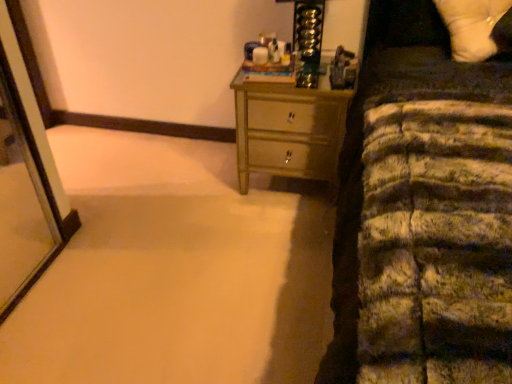
Image resolution: width=512 pixels, height=384 pixels. What do you see at coordinates (287, 128) in the screenshot?
I see `metallic gold chest of drawers at center` at bounding box center [287, 128].

This screenshot has width=512, height=384. What are the coordinates of `metallic gold chest of drawers at center` in the screenshot? It's located at (287, 128).

This screenshot has width=512, height=384. Identify the location of white soft pillow at upper right. (472, 26).

Measure the distance between white soft pillow at upper right and camera.

A distance of 4.73 feet exists between white soft pillow at upper right and camera.

Describe the element at coordinates (472, 26) in the screenshot. This screenshot has width=512, height=384. I see `white soft pillow at upper right` at that location.

Locate an element on the screen. The width and height of the screenshot is (512, 384). metallic gold chest of drawers at center is located at coordinates (287, 128).

Which is more to the right, metallic gold chest of drawers at center or white soft pillow at upper right?

Positioned to the right is white soft pillow at upper right.

In the image, is metallic gold chest of drawers at center positioned in front of or behind white soft pillow at upper right?

Visually, metallic gold chest of drawers at center is located behind white soft pillow at upper right.

Considering the positions of points (245, 130) and (488, 47), is point (245, 130) closer to camera compared to point (488, 47)?

No, it is not.

From the image's perspective, is metallic gold chest of drawers at center positioned above or below white soft pillow at upper right?

From the image's perspective, metallic gold chest of drawers at center appears below white soft pillow at upper right.

From a real-world perspective, is metallic gold chest of drawers at center physically below white soft pillow at upper right?

Yes, from a real-world perspective, metallic gold chest of drawers at center is beneath white soft pillow at upper right.

Considering the relative sizes of metallic gold chest of drawers at center and white soft pillow at upper right in the image provided, is metallic gold chest of drawers at center thinner than white soft pillow at upper right?

Incorrect, the width of metallic gold chest of drawers at center is not less than that of white soft pillow at upper right.

Considering the relative sizes of metallic gold chest of drawers at center and white soft pillow at upper right in the image provided, is metallic gold chest of drawers at center taller than white soft pillow at upper right?

Correct, metallic gold chest of drawers at center is much taller as white soft pillow at upper right.

Can you confirm if metallic gold chest of drawers at center is smaller than white soft pillow at upper right?

Actually, metallic gold chest of drawers at center might be larger than white soft pillow at upper right.

Is white soft pillow at upper right located within metallic gold chest of drawers at center?

Actually, white soft pillow at upper right is outside metallic gold chest of drawers at center.

Are metallic gold chest of drawers at center and white soft pillow at upper right far apart?

No, metallic gold chest of drawers at center is not far from white soft pillow at upper right.

Is metallic gold chest of drawers at center facing away from white soft pillow at upper right?

No.

There is a metallic gold chest of drawers at center. Where is `pillow above it (from a real-world perspective)`? Image resolution: width=512 pixels, height=384 pixels. pillow above it (from a real-world perspective) is located at coordinates click(472, 26).

Which is more to the right, white soft pillow at upper right or metallic gold chest of drawers at center?

white soft pillow at upper right is more to the right.

Considering the relative positions of white soft pillow at upper right and metallic gold chest of drawers at center in the image provided, is white soft pillow at upper right behind metallic gold chest of drawers at center?

No, it is in front of metallic gold chest of drawers at center.

Does point (507, 9) come in front of point (294, 79)?

Yes, point (507, 9) is in front of point (294, 79).

From the image's perspective, would you say white soft pillow at upper right is shown under metallic gold chest of drawers at center?

No.

Consider the image. From a real-world perspective, is white soft pillow at upper right on metallic gold chest of drawers at center?

Yes.

Looking at their sizes, would you say white soft pillow at upper right is wider or thinner than metallic gold chest of drawers at center?

In the image, white soft pillow at upper right appears to be more narrow than metallic gold chest of drawers at center.

In terms of height, does white soft pillow at upper right look taller or shorter compared to metallic gold chest of drawers at center?

white soft pillow at upper right is shorter than metallic gold chest of drawers at center.

Does white soft pillow at upper right have a larger size compared to metallic gold chest of drawers at center?

No, white soft pillow at upper right is not bigger than metallic gold chest of drawers at center.

Choose the correct answer: Is white soft pillow at upper right inside metallic gold chest of drawers at center or outside it?

white soft pillow at upper right lies outside metallic gold chest of drawers at center.

Is white soft pillow at upper right touching metallic gold chest of drawers at center?

white soft pillow at upper right and metallic gold chest of drawers at center are clearly separated.

Is white soft pillow at upper right turned away from metallic gold chest of drawers at center?

No, white soft pillow at upper right's orientation is not away from metallic gold chest of drawers at center.

Based on the photo, how many degrees apart are the facing directions of white soft pillow at upper right and metallic gold chest of drawers at center?

The facing directions of white soft pillow at upper right and metallic gold chest of drawers at center are 7.64 degrees apart.

How distant is white soft pillow at upper right from metallic gold chest of drawers at center?

white soft pillow at upper right and metallic gold chest of drawers at center are 25.59 inches apart.

The height and width of the screenshot is (384, 512). What are the coordinates of `the chest of drawers located underneath the white soft pillow at upper right (from a real-world perspective)` in the screenshot? It's located at (287, 128).

The image size is (512, 384). I want to click on pillow above the metallic gold chest of drawers at center (from the image's perspective), so click(472, 26).

This screenshot has height=384, width=512. Identify the location of the chest of drawers that is behind the white soft pillow at upper right. (287, 128).